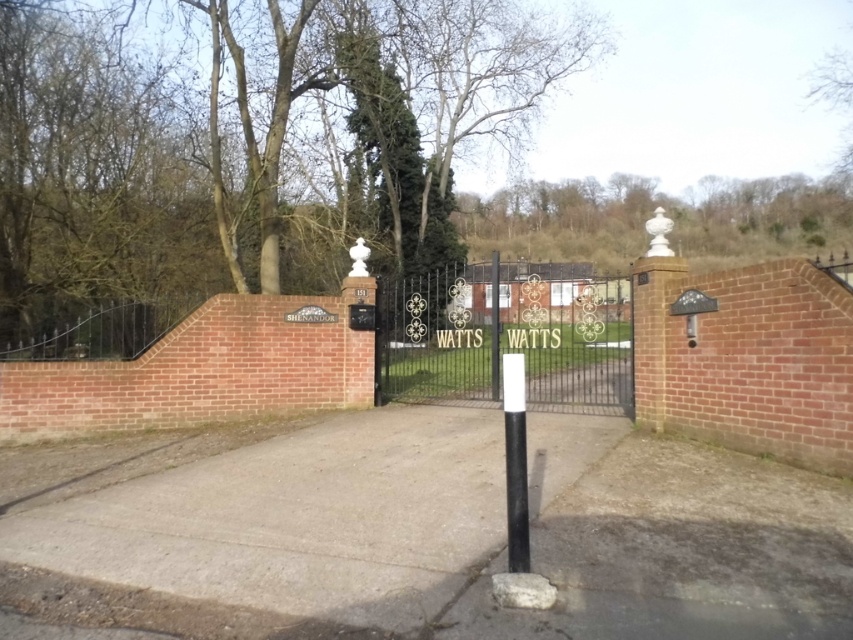
Question: Which point appears farthest from the camera in this image?

Choices:
 (A) (508, 554)
 (B) (498, 371)
 (C) (418, 310)

Answer: (C)

Question: Can you confirm if black wrought iron gate at center is positioned below white glossy pole at center?

Choices:
 (A) no
 (B) yes

Answer: (B)

Question: Which point is closer to the camera?

Choices:
 (A) black wrought iron gate at center
 (B) black matte pole at center
 (C) white glossy pole at center

Answer: (B)

Question: Is black wrought iron gate at center below white glossy pole at center?

Choices:
 (A) yes
 (B) no

Answer: (A)

Question: Can you confirm if black matte pole at center is positioned to the left of white glossy pole at center?

Choices:
 (A) yes
 (B) no

Answer: (A)

Question: Which point is farther to the camera?

Choices:
 (A) (447, 348)
 (B) (492, 392)
 (C) (505, 420)

Answer: (B)